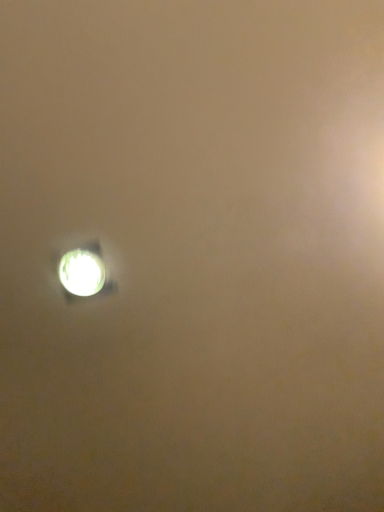
Where is `white glossy light bulb at upper left`? white glossy light bulb at upper left is located at coordinates (82, 272).

The height and width of the screenshot is (512, 384). What do you see at coordinates (82, 272) in the screenshot? I see `white glossy light bulb at upper left` at bounding box center [82, 272].

Find the location of `white glossy light bulb at upper left`. white glossy light bulb at upper left is located at coordinates point(82,272).